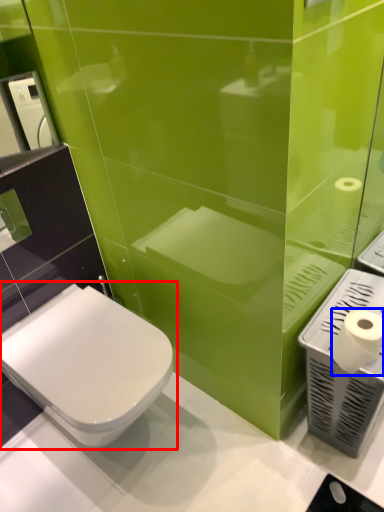
Question: Among these objects, which one is nearest to the camera, toilet (highlighted by a red box) or toilet paper (highlighted by a blue box)?

Choices:
 (A) toilet
 (B) toilet paper

Answer: (B)